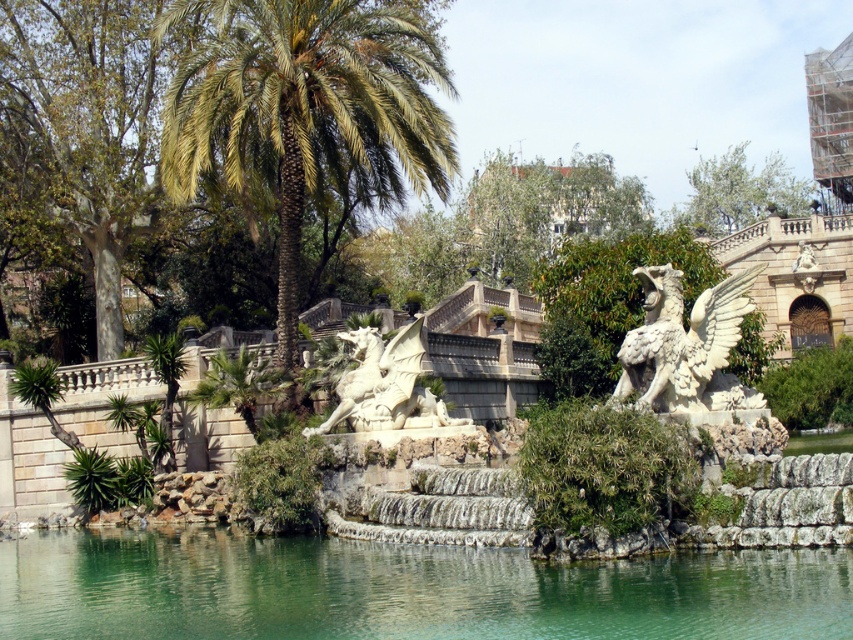
You are planning to place a new decorative statue in the garden. The statue you have is 1.2 meters tall. The green stone water at center and the white stone dragon at center are already present. Based on their sizes, which existing object would be more appropriate to place the new statue next to in terms of scale?

The green stone water at center has a larger size compared to the white stone dragon at center. Since your new statue is 1.2 meters tall, it would be more appropriate to place it next to the white stone dragon at center to maintain a balanced scale, as the dragon is smaller and the new statue would complement its size better.

You are a landscape architect designing a new garden layout. You need to ensure that the green stone water at center and the white stone dragon at center are visible from a viewing platform located at the northern edge of the garden. Considering their heights, which object will appear taller when viewed from that platform?

The green stone water at center has a greater height compared to the white stone dragon at center, so it will appear taller when viewed from the northern edge platform.

You are a visitor standing in the garden and want to take a photo of both the white stone winged creature at center right and the white stone dragon at center. Which one should you aim your camera at first to ensure both are in frame?

You should aim your camera at the white stone dragon at center first because the white stone winged creature at center right is located above it, so adjusting the frame to include the dragon will naturally include the creature above.